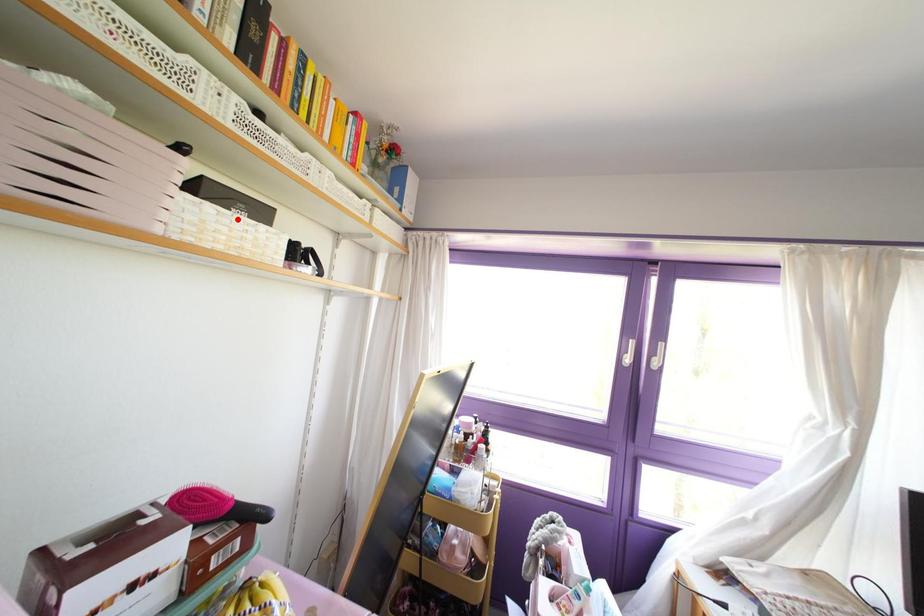
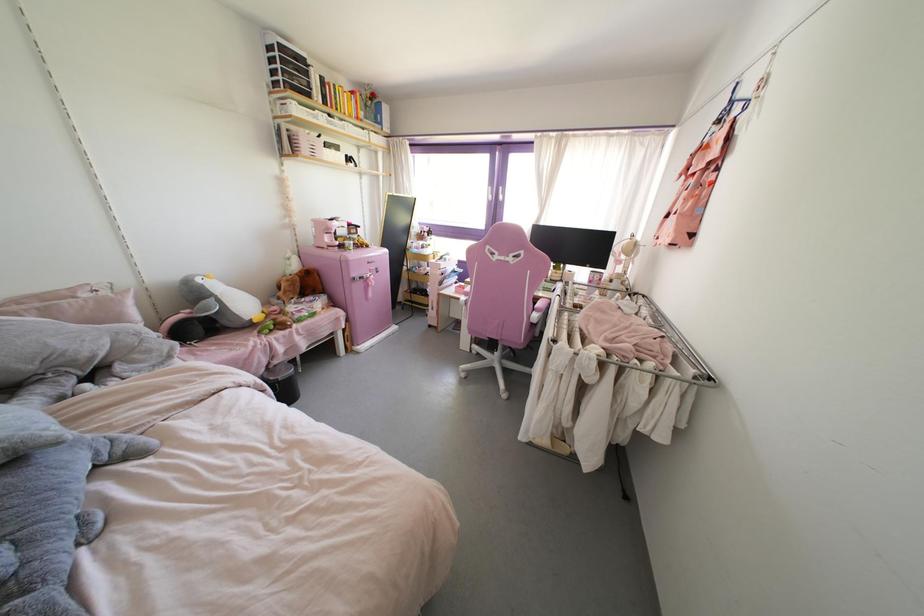
In the second image, find the point that corresponds to the highlighted location in the first image.

(333, 151)